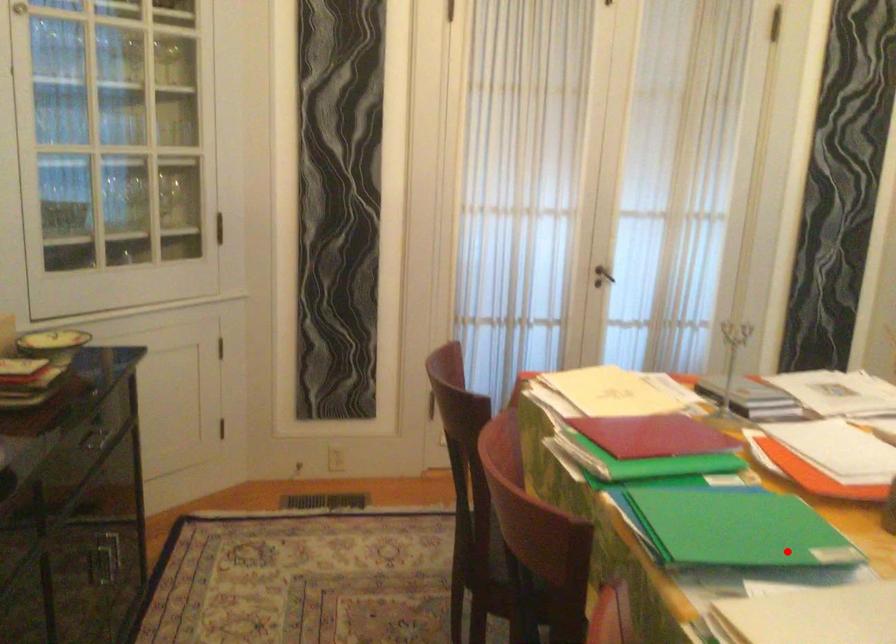
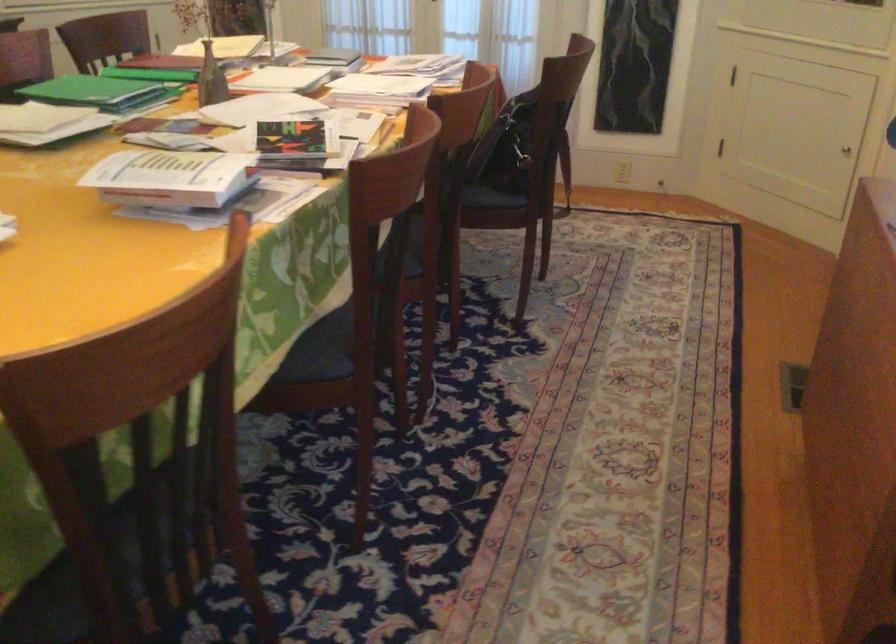
Locate, in the second image, the point that corresponds to the highlighted location in the first image.

(99, 91)